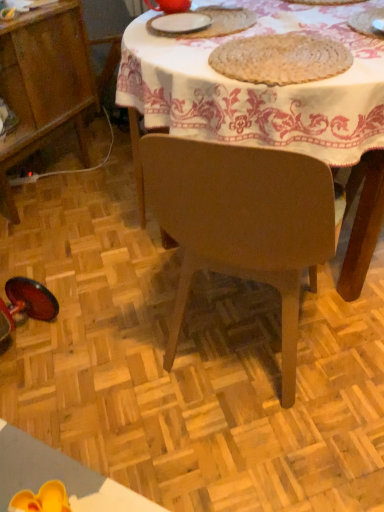
Question: Would you consider brown woven placemat at upper center to be distant from white matte plate at upper center, marked as the 2th tableware in a right-to-left arrangement?

Choices:
 (A) no
 (B) yes

Answer: (A)

Question: Can you confirm if brown woven placemat at upper center is positioned to the right of white matte plate at upper center, the 2th tableware in the left-to-right sequence?

Choices:
 (A) no
 (B) yes

Answer: (B)

Question: Would you say white matte plate at upper center, marked as the 2th tableware in a right-to-left arrangement, is part of brown woven placemat at upper center's contents?

Choices:
 (A) no
 (B) yes

Answer: (A)

Question: Is brown woven placemat at upper center looking in the opposite direction of white matte plate at upper center, the 2th tableware in the left-to-right sequence?

Choices:
 (A) yes
 (B) no

Answer: (B)

Question: Is brown woven placemat at upper center with white matte plate at upper center, the 2th tableware in the left-to-right sequence?

Choices:
 (A) no
 (B) yes

Answer: (A)

Question: Does brown woven placemat at upper center turn towards white matte plate at upper center, the 2th tableware in the left-to-right sequence?

Choices:
 (A) yes
 (B) no

Answer: (B)

Question: Does wooden table at center have a greater width compared to brown woven placemat at upper center?

Choices:
 (A) yes
 (B) no

Answer: (A)

Question: From a real-world perspective, is wooden table at center on brown woven placemat at upper center?

Choices:
 (A) yes
 (B) no

Answer: (B)

Question: Does wooden table at center have a lesser height compared to brown woven placemat at upper center?

Choices:
 (A) no
 (B) yes

Answer: (A)

Question: Is wooden table at center with brown woven placemat at upper center?

Choices:
 (A) no
 (B) yes

Answer: (A)

Question: Considering the relative sizes of wooden table at center and brown woven placemat at upper center in the image provided, is wooden table at center taller than brown woven placemat at upper center?

Choices:
 (A) no
 (B) yes

Answer: (B)

Question: Is wooden table at center not inside brown woven placemat at upper center?

Choices:
 (A) yes
 (B) no

Answer: (A)

Question: Is white matte plate at upper center, marked as the 2th tableware in a right-to-left arrangement, turned away from white woven placemat at upper right, which ranks as the 1th tableware in right-to-left order?

Choices:
 (A) yes
 (B) no

Answer: (B)